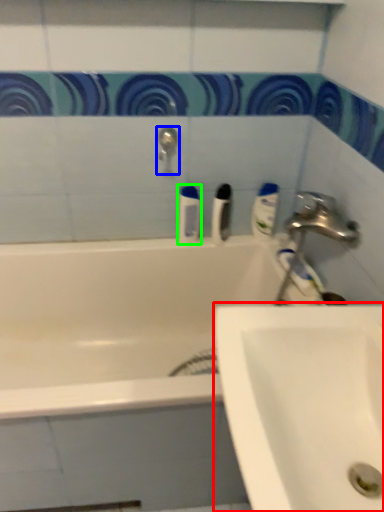
Question: Considering the real-world distances, which object is farthest from sink (highlighted by a red box)? tap (highlighted by a blue box) or mouthwash (highlighted by a green box)?

Choices:
 (A) tap
 (B) mouthwash

Answer: (A)